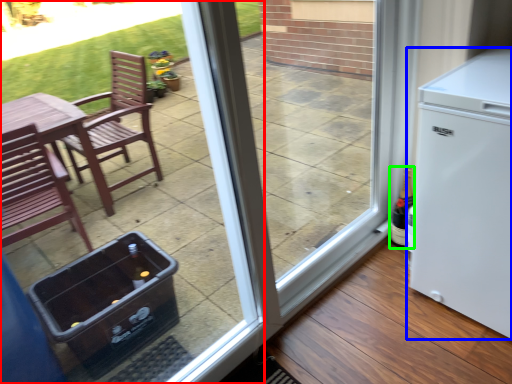
Question: Which object is positioned closest to door (highlighted by a red box)? Select from refrigerator (highlighted by a blue box) and bottle (highlighted by a green box).

Choices:
 (A) refrigerator
 (B) bottle

Answer: (A)